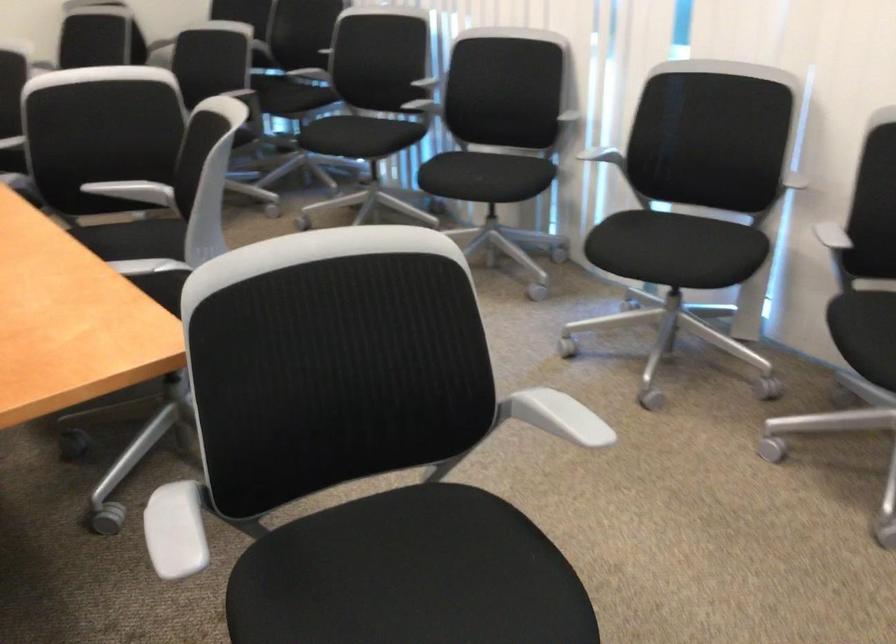
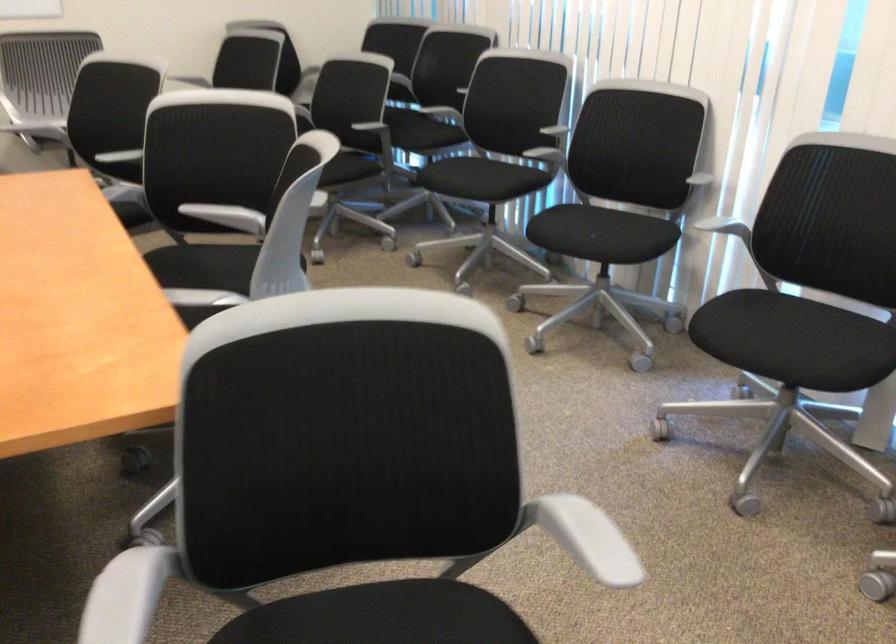
The point at (563, 111) is marked in the first image. Where is the corresponding point in the second image?

(693, 174)